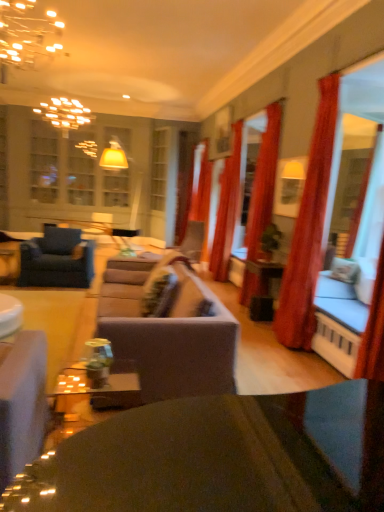
Question: Would you say velvet blue armchair at left is outside red velvet curtain at right, which ranks as the 3th curtain in back-to-front order?

Choices:
 (A) no
 (B) yes

Answer: (B)

Question: Does velvet blue armchair at left have a smaller size compared to red velvet curtain at right, which ranks as the 3th curtain in back-to-front order?

Choices:
 (A) no
 (B) yes

Answer: (A)

Question: From a real-world perspective, is velvet blue armchair at left on red velvet curtain at right, which ranks as the 3th curtain in back-to-front order?

Choices:
 (A) no
 (B) yes

Answer: (A)

Question: Would you say velvet blue armchair at left contains red velvet curtain at right, acting as the 2th curtain starting from the front?

Choices:
 (A) yes
 (B) no

Answer: (B)

Question: From the image's perspective, does velvet blue armchair at left appear lower than red velvet curtain at right, which ranks as the 3th curtain in back-to-front order?

Choices:
 (A) yes
 (B) no

Answer: (A)

Question: Considering the positions of red velvet curtain at right, which ranks as the 3th curtain in back-to-front order, and velvet grey couch at right in the image, is red velvet curtain at right, which ranks as the 3th curtain in back-to-front order, taller or shorter than velvet grey couch at right?

Choices:
 (A) short
 (B) tall

Answer: (B)

Question: Is point (248, 204) closer or farther from the camera than point (357, 351)?

Choices:
 (A) closer
 (B) farther

Answer: (B)

Question: Visually, is red velvet curtain at right, acting as the 2th curtain starting from the front, positioned to the left or to the right of velvet grey couch at right?

Choices:
 (A) right
 (B) left

Answer: (B)

Question: Based on their sizes in the image, would you say red velvet curtain at right, acting as the 2th curtain starting from the front, is bigger or smaller than velvet grey couch at right?

Choices:
 (A) big
 (B) small

Answer: (A)

Question: Relative to red velvet curtain at right, which ranks as the 3th curtain in back-to-front order, is velvet grey couch at right in front or behind?

Choices:
 (A) front
 (B) behind

Answer: (A)

Question: Looking at their shapes, would you say velvet grey couch at right is wider or thinner than red velvet curtain at right, acting as the 2th curtain starting from the front?

Choices:
 (A) wide
 (B) thin

Answer: (A)

Question: Based on their positions, is velvet grey couch at right located to the left or right of red velvet curtain at right, acting as the 2th curtain starting from the front?

Choices:
 (A) right
 (B) left

Answer: (A)

Question: Which is correct: velvet grey couch at right is inside red velvet curtain at right, acting as the 2th curtain starting from the front, or outside of it?

Choices:
 (A) inside
 (B) outside

Answer: (B)

Question: Choose the correct answer: Is velvet blue armchair at left inside gold metallic chandelier at upper left or outside it?

Choices:
 (A) inside
 (B) outside

Answer: (B)

Question: Considering the positions of velvet blue armchair at left and gold metallic chandelier at upper left in the image, is velvet blue armchair at left bigger or smaller than gold metallic chandelier at upper left?

Choices:
 (A) small
 (B) big

Answer: (B)